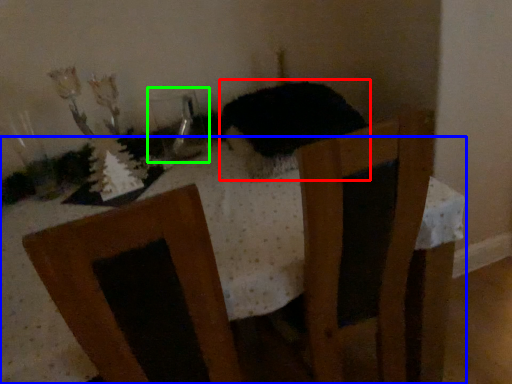
Question: Which object is the closest to the animal (highlighted by a red box)? Choose among these: table (highlighted by a blue box) or glass vase (highlighted by a green box).

Choices:
 (A) table
 (B) glass vase

Answer: (A)